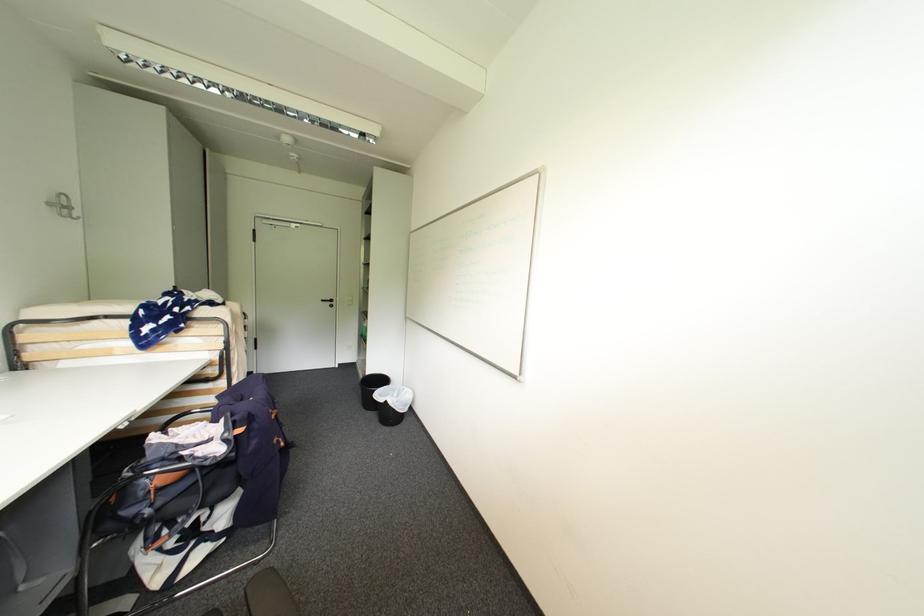
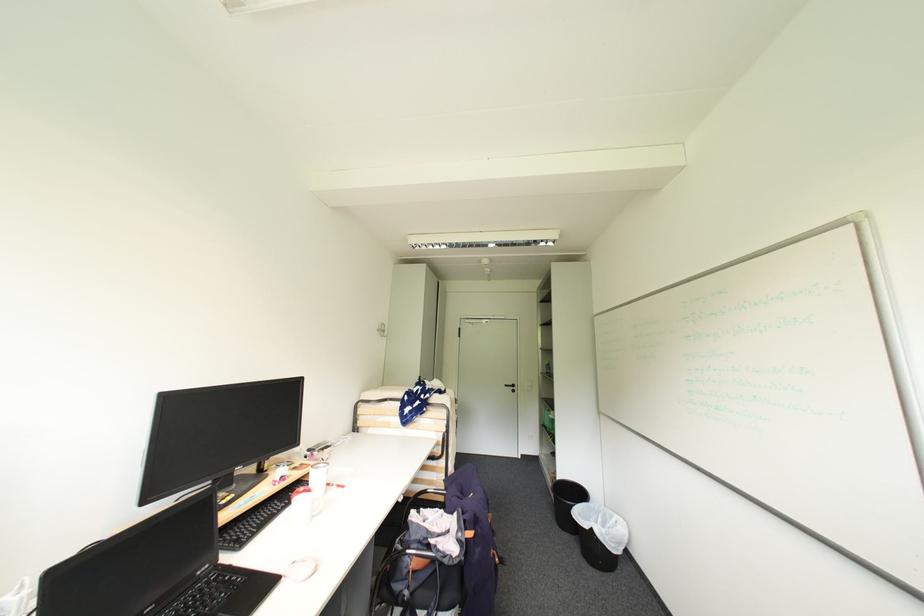
In the second image, find the point that corresponds to (x=188, y=460) in the first image.

(435, 548)